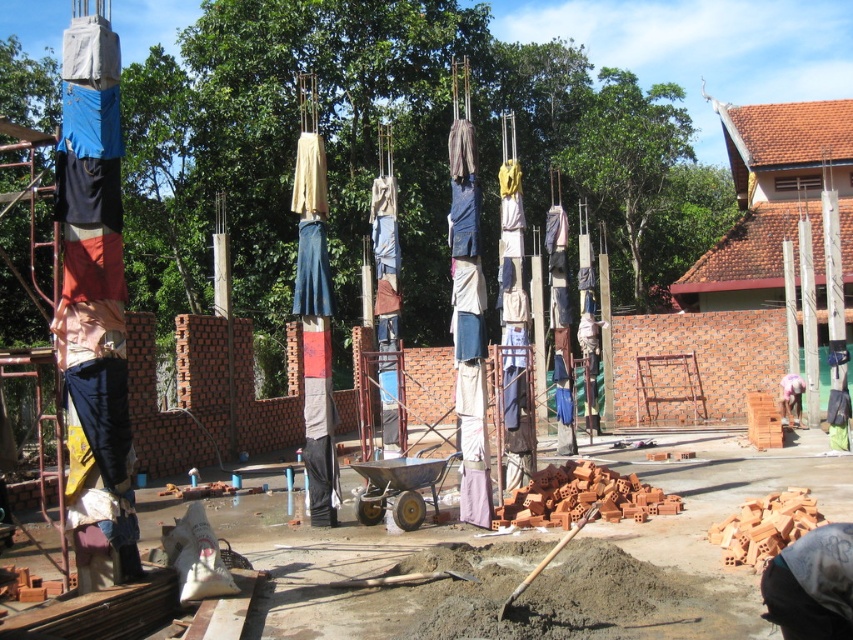
Question: Among these points, which one is nearest to the camera?

Choices:
 (A) (799, 394)
 (B) (582, 349)

Answer: (A)

Question: Can you confirm if light brown fabric at center is bigger than light pink fabric at center?

Choices:
 (A) yes
 (B) no

Answer: (A)

Question: Does light brown fabric at center have a smaller size compared to light pink fabric at center?

Choices:
 (A) no
 (B) yes

Answer: (A)

Question: Among these points, which one is nearest to the camera?

Choices:
 (A) (589, 390)
 (B) (782, 388)

Answer: (A)

Question: Can you confirm if light brown fabric at center is positioned below light pink fabric at center?

Choices:
 (A) yes
 (B) no

Answer: (B)